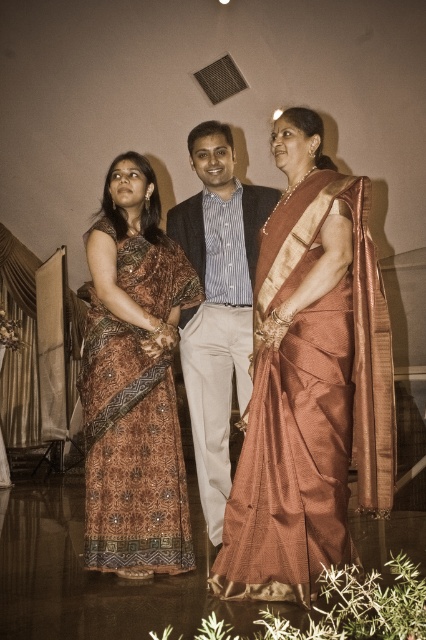
Question: Can you confirm if brown printed saree at left is positioned above silk shirt at center?

Choices:
 (A) yes
 (B) no

Answer: (B)

Question: Which point is closer to the camera taking this photo?

Choices:
 (A) (126, 477)
 (B) (226, 490)

Answer: (A)

Question: Does brown printed saree at left have a smaller size compared to silk shirt at center?

Choices:
 (A) no
 (B) yes

Answer: (B)

Question: Is shiny gold saree at center smaller than silk shirt at center?

Choices:
 (A) yes
 (B) no

Answer: (B)

Question: Which object is closer to the camera taking this photo?

Choices:
 (A) silk shirt at center
 (B) shiny gold saree at center
 (C) brown printed saree at left

Answer: (B)

Question: Which point is closer to the camera?

Choices:
 (A) shiny gold saree at center
 (B) silk shirt at center
 (C) brown printed saree at left

Answer: (A)